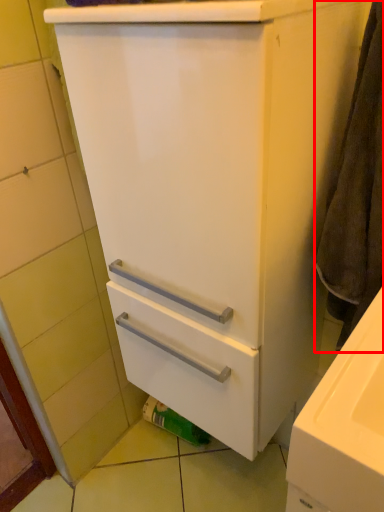
Question: In this image, where is bath towel (annotated by the red box) located relative to toilet paper?

Choices:
 (A) right
 (B) left

Answer: (A)